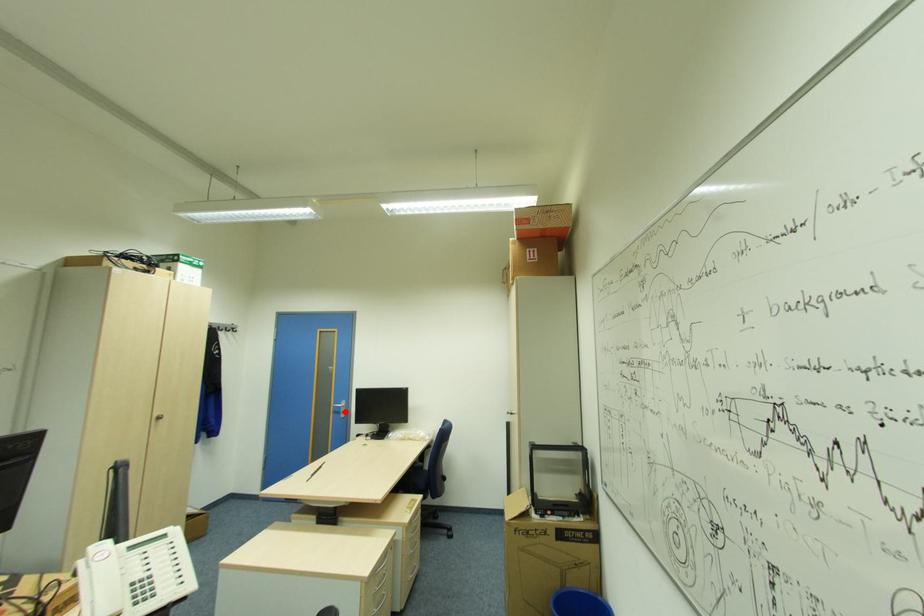
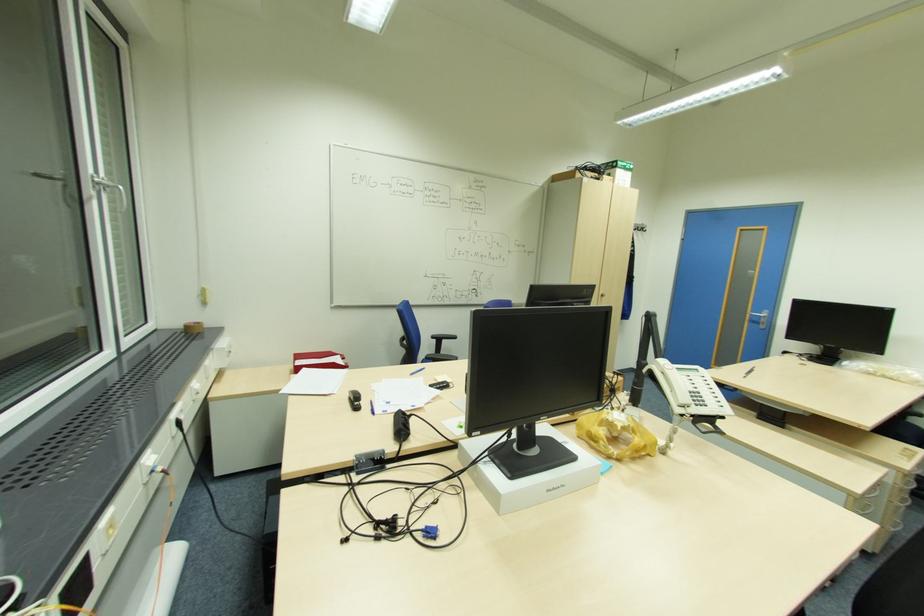
The point at the highlighted location is marked in the first image. Where is the corresponding point in the second image?

(766, 323)